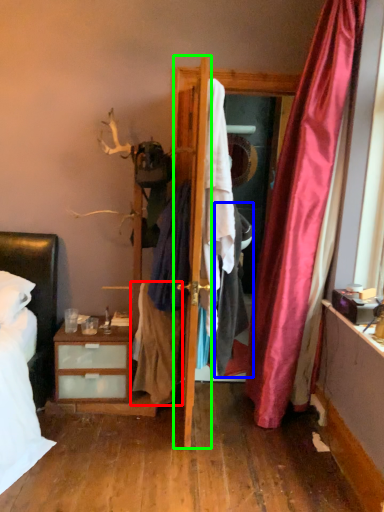
Question: Which object is positioned closest to clothing (highlighted by a red box)? Select from clothing (highlighted by a blue box) and door (highlighted by a green box).

Choices:
 (A) clothing
 (B) door

Answer: (A)